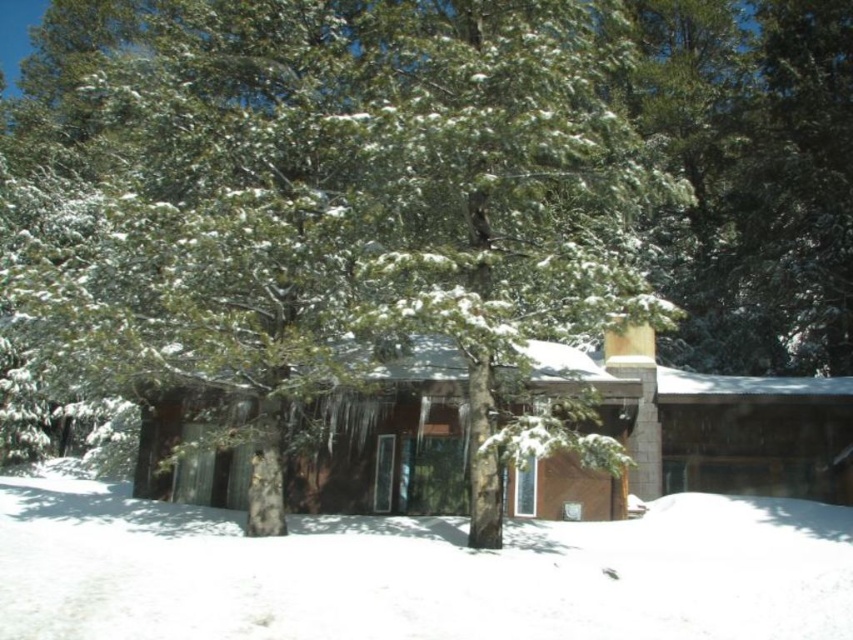
Question: Is white fluffy snow at lower center behind brown wood cabin at center?

Choices:
 (A) yes
 (B) no

Answer: (B)

Question: Is white fluffy snow at lower center thinner than brown wood cabin at center?

Choices:
 (A) yes
 (B) no

Answer: (A)

Question: Which point is closer to the camera?

Choices:
 (A) white fluffy snow at lower center
 (B) brown wood cabin at center

Answer: (A)

Question: Does white fluffy snow at lower center appear on the right side of brown wood cabin at center?

Choices:
 (A) yes
 (B) no

Answer: (B)